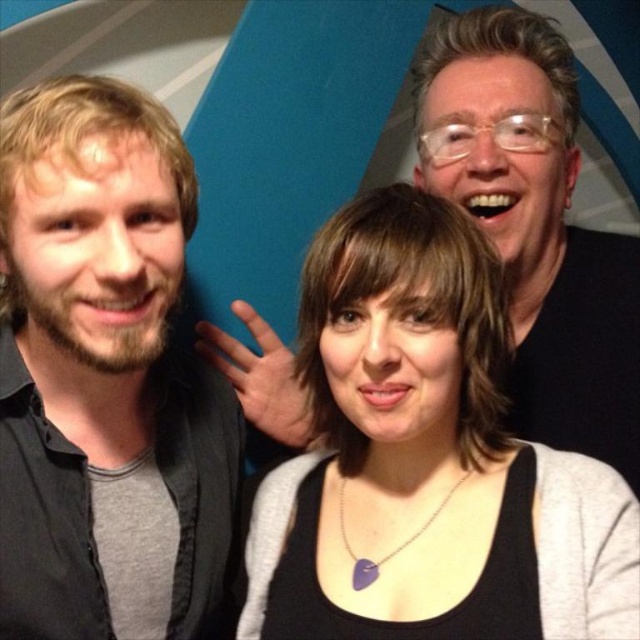
Question: Can you confirm if black matte necklace at center is thinner than matte black shirt at left?

Choices:
 (A) yes
 (B) no

Answer: (B)

Question: Considering the real-world distances, which object is farthest from the matte black shirt at upper right?

Choices:
 (A) matte black shirt at left
 (B) black matte necklace at center

Answer: (A)

Question: Is black matte necklace at center thinner than matte black shirt at left?

Choices:
 (A) no
 (B) yes

Answer: (A)

Question: Which is nearer to the black matte necklace at center?

Choices:
 (A) matte black shirt at left
 (B) matte black shirt at upper right

Answer: (A)

Question: Which object is positioned closest to the black matte necklace at center?

Choices:
 (A) matte black shirt at upper right
 (B) matte black shirt at left

Answer: (B)

Question: Does black matte necklace at center have a greater width compared to matte black shirt at left?

Choices:
 (A) yes
 (B) no

Answer: (A)